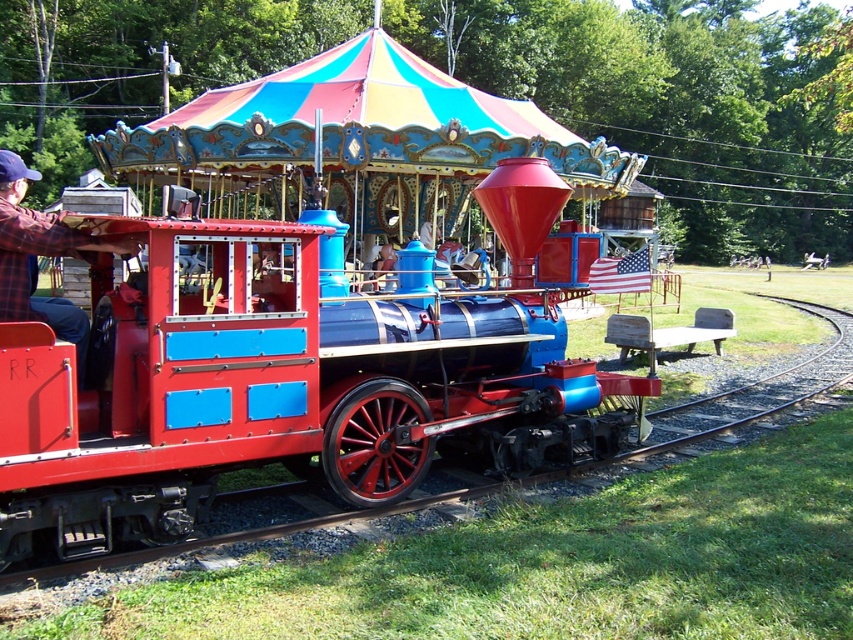
Who is shorter, shiny red locomotive at center or plaid flannel shirt at left?

shiny red locomotive at center is shorter.

From the picture: Does shiny red locomotive at center have a greater width compared to plaid flannel shirt at left?

In fact, shiny red locomotive at center might be narrower than plaid flannel shirt at left.

At what (x,y) coordinates should I click in order to perform the action: click on shiny red locomotive at center. Please return your answer as a coordinate pair (x, y). Looking at the image, I should click on (287, 371).